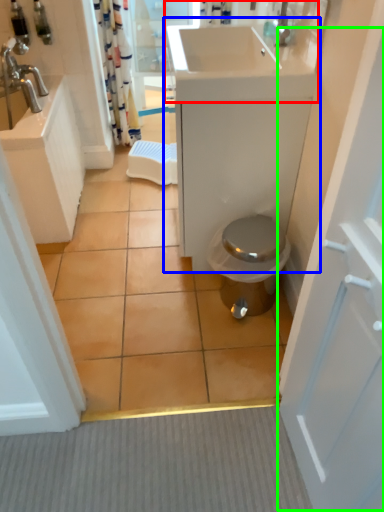
Question: Which object is positioned farthest from sink (highlighted by a red box)? Select from bathroom cabinet (highlighted by a blue box) and screen door (highlighted by a green box).

Choices:
 (A) bathroom cabinet
 (B) screen door

Answer: (B)